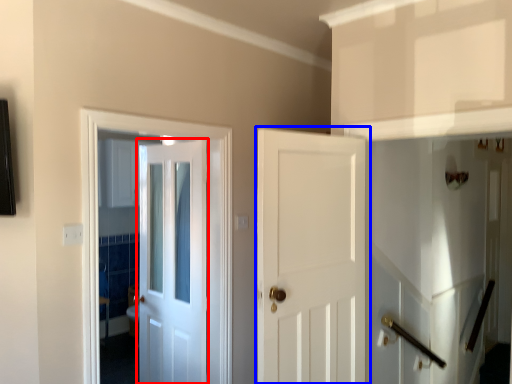
Question: Which object appears farthest to the camera in this image, door (highlighted by a red box) or door (highlighted by a blue box)?

Choices:
 (A) door
 (B) door

Answer: (A)